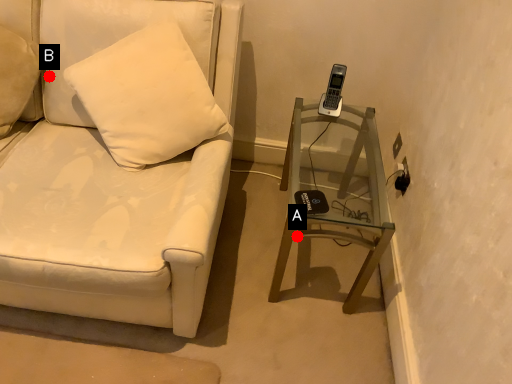
Question: Two points are circled on the image, labeled by A and B beside each circle. Which point is further to the camera?

Choices:
 (A) A is further
 (B) B is further

Answer: (B)